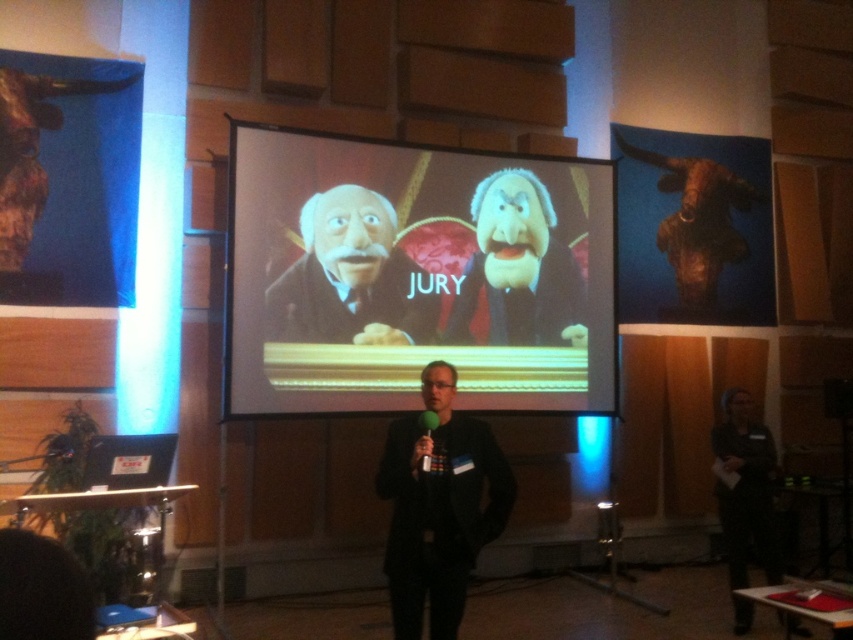
Question: Can you confirm if black matte suit at center is positioned to the left of smooth puppet at center?

Choices:
 (A) no
 (B) yes

Answer: (B)

Question: Which of these objects is positioned closest to the black matte suit at center?

Choices:
 (A) smooth puppet at center
 (B) matte black screen at center
 (C) dark gray suit at lower right
 (D) smooth brown puppet at center

Answer: (D)

Question: Which point is farther to the camera?

Choices:
 (A) 730,410
 (B) 547,352
 (C) 496,496
 (D) 548,218

Answer: (D)

Question: Which point is closer to the camera?

Choices:
 (A) (444, 529)
 (B) (737, 496)
 (C) (277, 316)

Answer: (A)

Question: Can you confirm if smooth puppet at center is wider than dark gray suit at lower right?

Choices:
 (A) yes
 (B) no

Answer: (A)

Question: Does smooth brown puppet at center appear on the right side of dark gray suit at lower right?

Choices:
 (A) yes
 (B) no

Answer: (B)